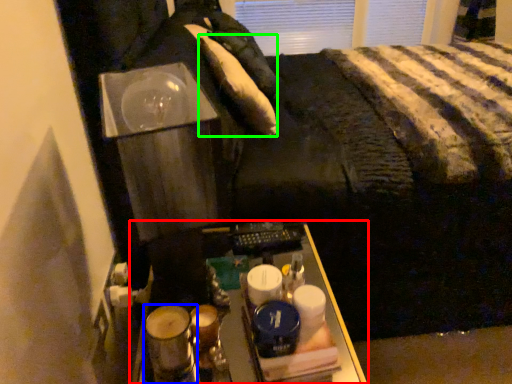
Question: Considering the real-world distances, which object is farthest from furniture (highlighted by a red box)? beverage (highlighted by a blue box) or pillow (highlighted by a green box)?

Choices:
 (A) beverage
 (B) pillow

Answer: (B)